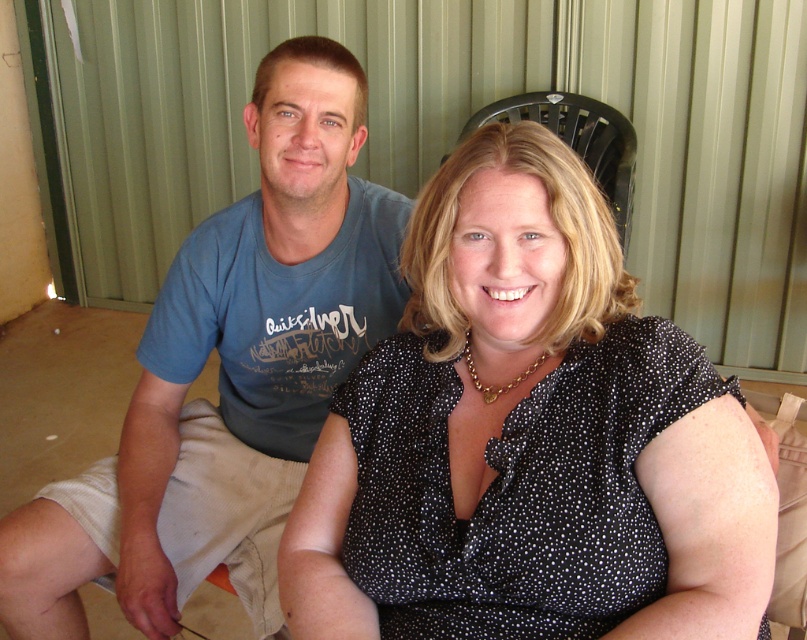
From the picture: You are standing in front of the two people in the image. Which of the two points, point (471,321) or point (540,116), is closer to you?

Point (471,321) is closer to the viewer than point (540,116).